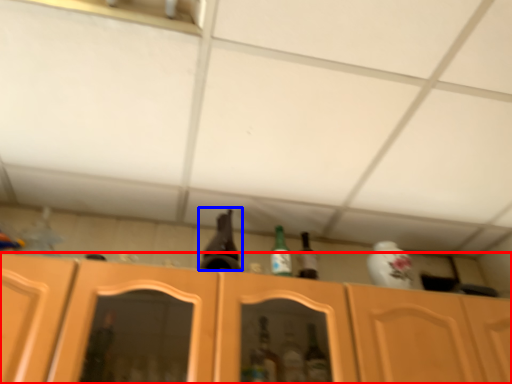
Question: Which object appears closest to the camera in this image, cabinetry (highlighted by a red box) or beer bottle (highlighted by a blue box)?

Choices:
 (A) cabinetry
 (B) beer bottle

Answer: (A)